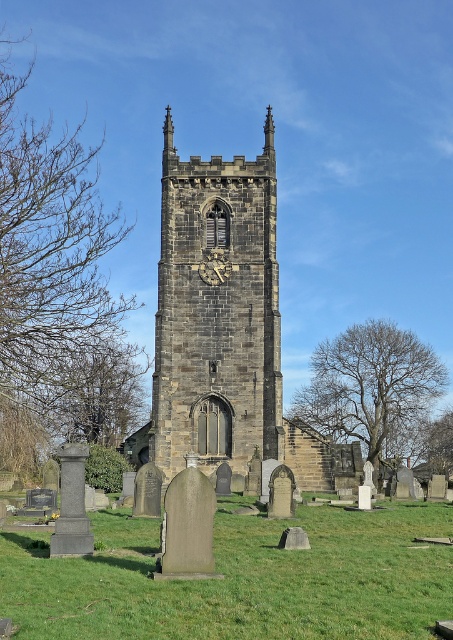
You are standing in the cemetery looking at the green grass at lower center and the dark gray stone church tower at center. Which area covers more ground?

The dark gray stone church tower at center occupies more space than the green grass at lower center.